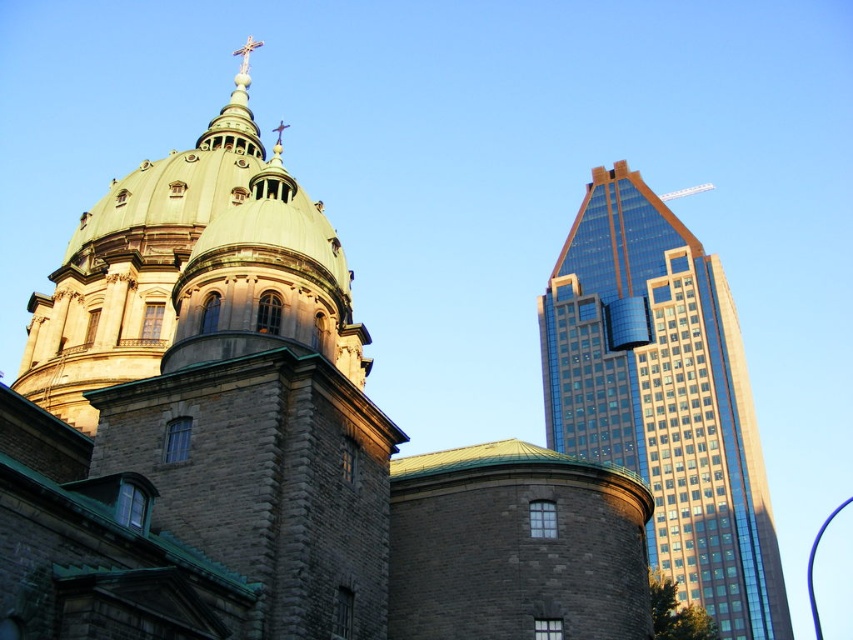
You are an architect analyzing the spatial relationship between the brown stone church at center and the shiny glass skyscraper at right. Based on the scene, which building is located to the left of the other?

The brown stone church at center is positioned on the left side of the shiny glass skyscraper at right.

You are standing in front of the historic church and the modern skyscraper. You notice two points marked on the image. Which point is closer to you, point(276, 221) or point(700, 275)?

Point(276, 221) is in front of point(700, 275), so it is closer to you.

You are an architect analyzing the image. Which structure is taller between the brown stone church at center and the shiny glass skyscraper at right?

The brown stone church at center is taller than the shiny glass skyscraper at right according to the description.